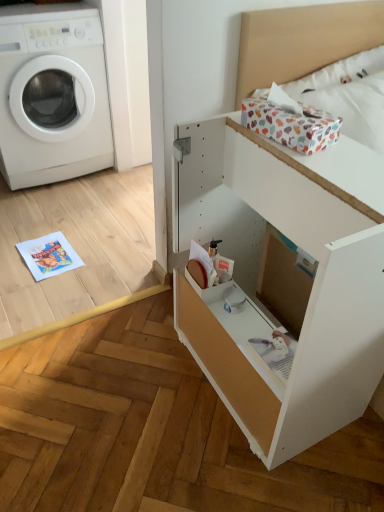
Question: Is white matte file cabinet at center inside white plastic washing machine at left?

Choices:
 (A) yes
 (B) no

Answer: (B)

Question: Could you tell me if white plastic washing machine at left is facing white matte file cabinet at center?

Choices:
 (A) yes
 (B) no

Answer: (A)

Question: Can you confirm if white plastic washing machine at left is thinner than white matte file cabinet at center?

Choices:
 (A) yes
 (B) no

Answer: (B)

Question: Is white plastic washing machine at left positioned with its back to white matte file cabinet at center?

Choices:
 (A) yes
 (B) no

Answer: (B)

Question: From a real-world perspective, is white plastic washing machine at left below white matte file cabinet at center?

Choices:
 (A) no
 (B) yes

Answer: (A)

Question: From the image's perspective, does white plastic washing machine at left appear lower than white matte file cabinet at center?

Choices:
 (A) yes
 (B) no

Answer: (B)

Question: From a real-world perspective, is white plastic washing machine at left over white cotton bedding at upper right?

Choices:
 (A) no
 (B) yes

Answer: (A)

Question: Does white plastic washing machine at left have a lesser width compared to white cotton bedding at upper right?

Choices:
 (A) yes
 (B) no

Answer: (B)

Question: Does white plastic washing machine at left turn towards white cotton bedding at upper right?

Choices:
 (A) yes
 (B) no

Answer: (B)

Question: Can you confirm if white plastic washing machine at left is smaller than white cotton bedding at upper right?

Choices:
 (A) yes
 (B) no

Answer: (B)

Question: Does white plastic washing machine at left have a greater width compared to white cotton bedding at upper right?

Choices:
 (A) no
 (B) yes

Answer: (B)

Question: Is there a large distance between white plastic washing machine at left and white cotton bedding at upper right?

Choices:
 (A) no
 (B) yes

Answer: (B)

Question: Is white cotton bedding at upper right surrounding white plastic washing machine at left?

Choices:
 (A) no
 (B) yes

Answer: (A)